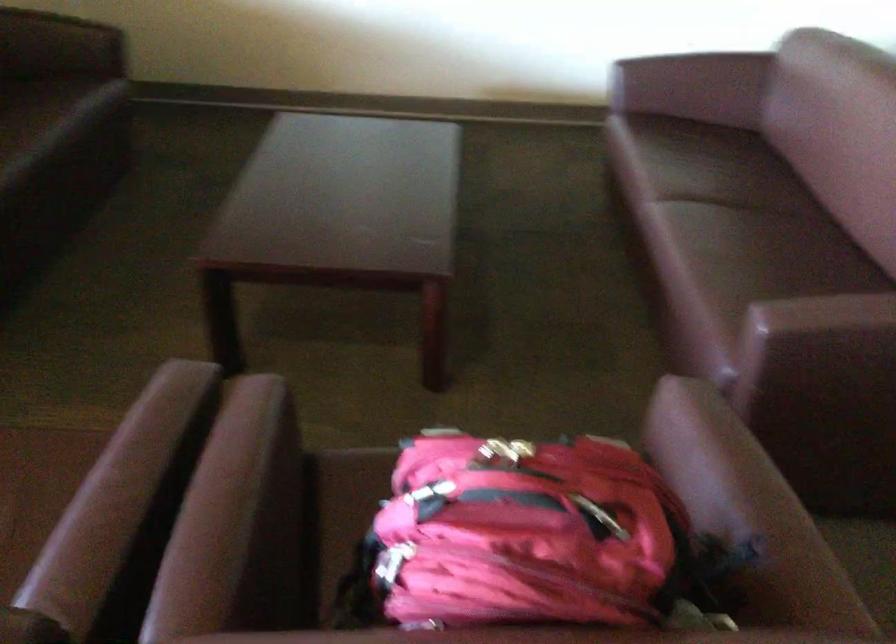
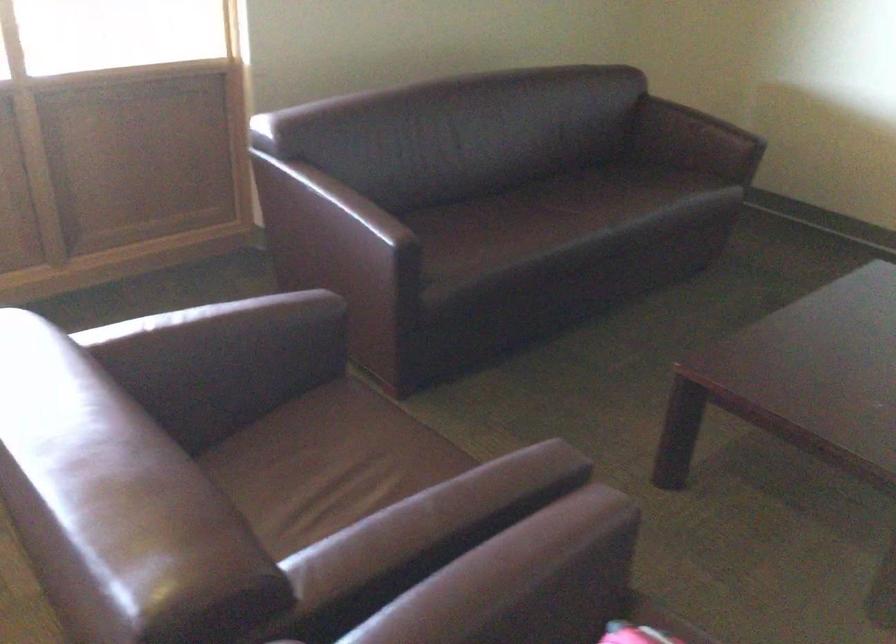
Question: The images are taken continuously from a first-person perspective. In which direction is your viewpoint rotating?

Choices:
 (A) Left
 (B) Right
 (C) Up
 (D) Down

Answer: (A)